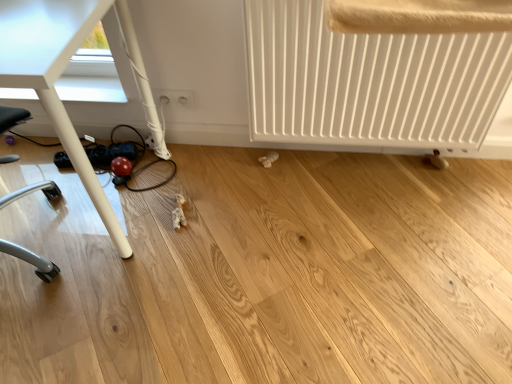
Question: From the image's perspective, is white matte radiator at lower right located beneath white plastic outlets at lower center?

Choices:
 (A) no
 (B) yes

Answer: (B)

Question: Is white matte radiator at lower right directly adjacent to white plastic outlets at lower center?

Choices:
 (A) yes
 (B) no

Answer: (B)

Question: Is white matte radiator at lower right behind white plastic outlets at lower center?

Choices:
 (A) no
 (B) yes

Answer: (A)

Question: Can you confirm if white matte radiator at lower right is taller than white plastic outlets at lower center?

Choices:
 (A) no
 (B) yes

Answer: (B)

Question: Is white matte radiator at lower right wider than white plastic outlets at lower center?

Choices:
 (A) yes
 (B) no

Answer: (A)

Question: Considering the relative sizes of white matte radiator at lower right and white plastic outlets at lower center in the image provided, is white matte radiator at lower right smaller than white plastic outlets at lower center?

Choices:
 (A) yes
 (B) no

Answer: (B)

Question: Considering the relative sizes of white plastic outlets at lower center and white glossy table at lower left in the image provided, is white plastic outlets at lower center taller than white glossy table at lower left?

Choices:
 (A) no
 (B) yes

Answer: (A)

Question: Is white plastic outlets at lower center to the right of white glossy table at lower left from the viewer's perspective?

Choices:
 (A) yes
 (B) no

Answer: (A)

Question: Is the position of white plastic outlets at lower center less distant than that of white glossy table at lower left?

Choices:
 (A) yes
 (B) no

Answer: (B)

Question: From the image's perspective, is white plastic outlets at lower center below white glossy table at lower left?

Choices:
 (A) no
 (B) yes

Answer: (A)

Question: Is white plastic outlets at lower center outside of white glossy table at lower left?

Choices:
 (A) yes
 (B) no

Answer: (A)

Question: From a real-world perspective, is white plastic outlets at lower center on top of white glossy table at lower left?

Choices:
 (A) no
 (B) yes

Answer: (A)

Question: Is white glossy table at lower left in front of white matte radiator at lower right?

Choices:
 (A) yes
 (B) no

Answer: (A)